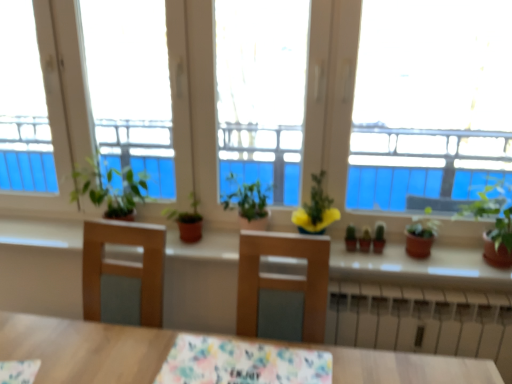
Locate an element on the screen. This screenshot has width=512, height=384. vacant area located to the right-hand side of green matte plant at center, which is the 1th plant in right-to-left order is located at coordinates (412, 251).